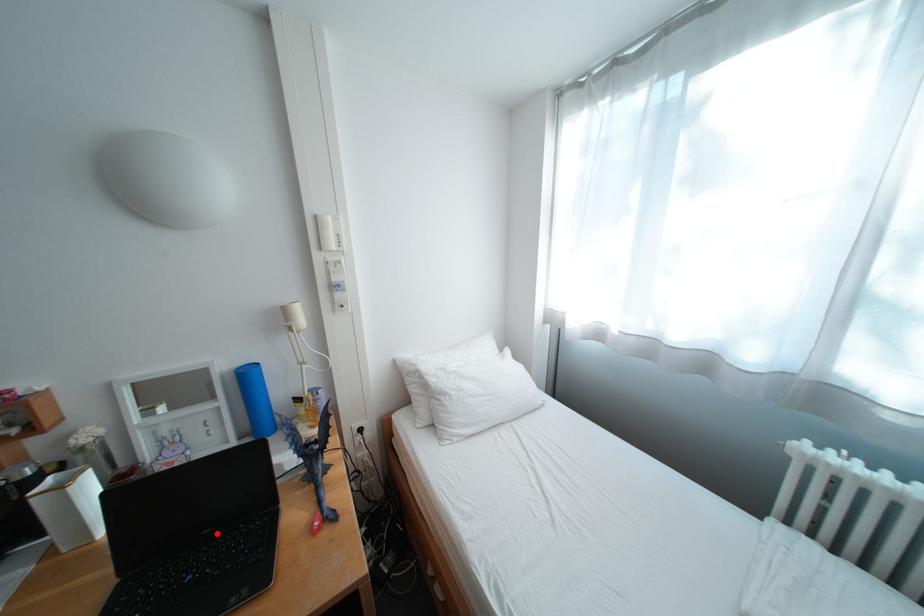
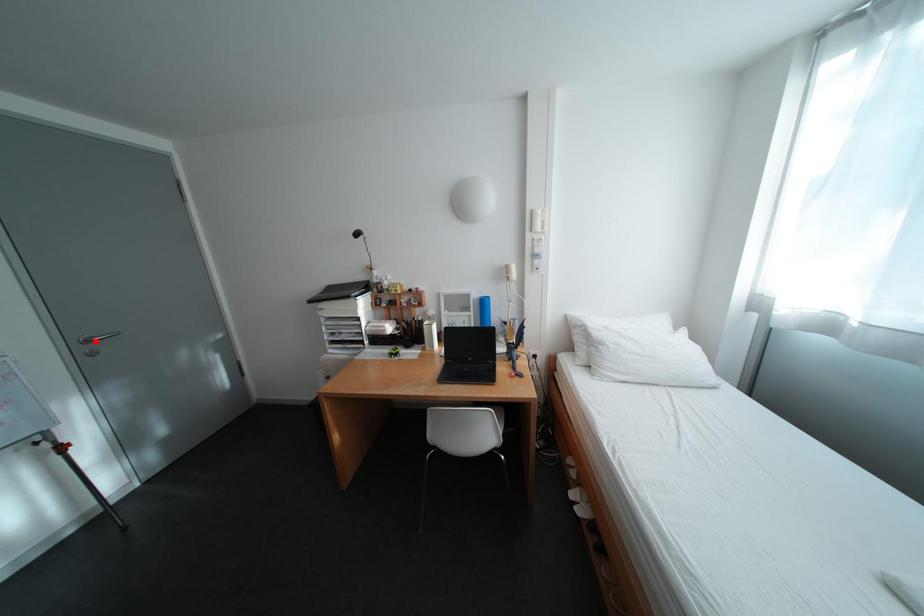
I am providing you with two images of the same scene from different viewpoints. A red point is marked on the first image and another point is marked on the second image. Do the highlighted points in image1 and image2 indicate the same real-world spot?

No